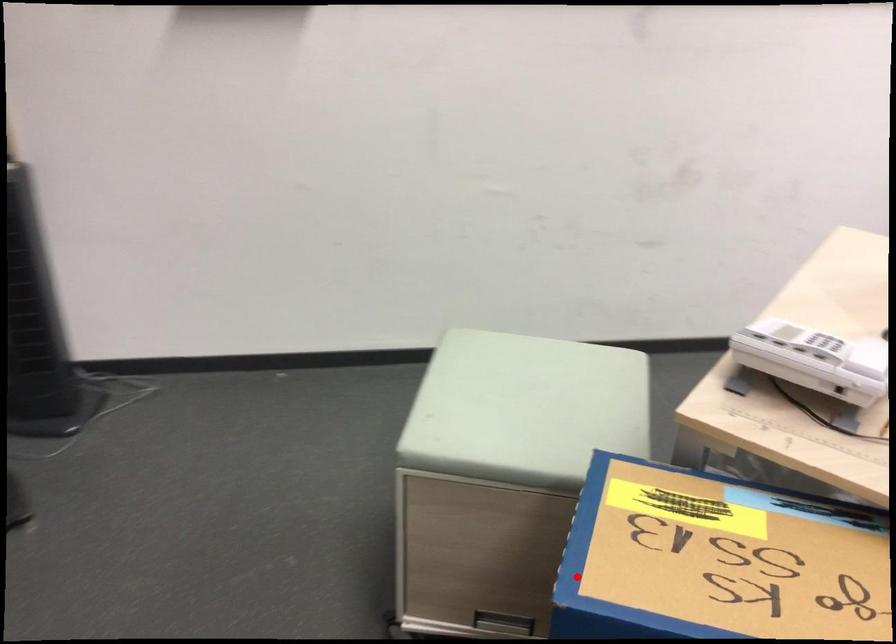
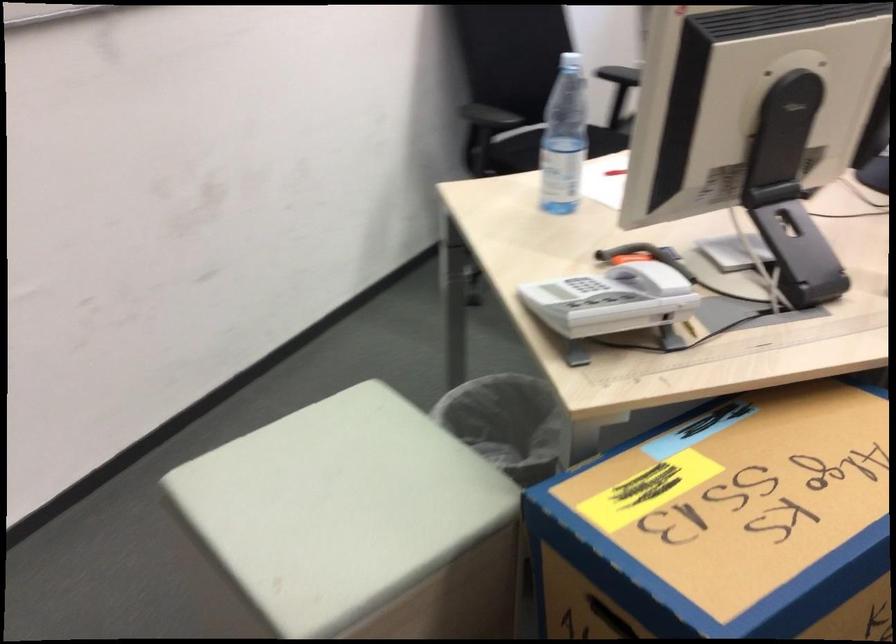
The point at the highlighted location is marked in the first image. Where is the corresponding point in the second image?

(600, 617)